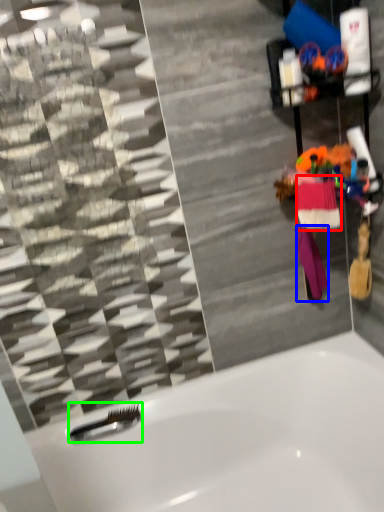
Question: Which object is positioned farthest from clothing (highlighted by a red box)? Select from clothing (highlighted by a blue box) and shower (highlighted by a green box).

Choices:
 (A) clothing
 (B) shower

Answer: (B)